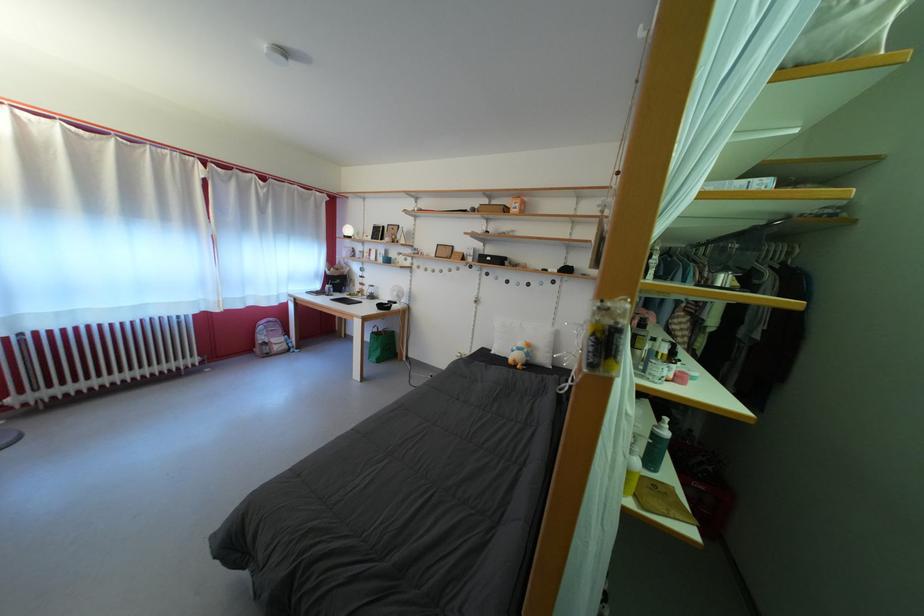
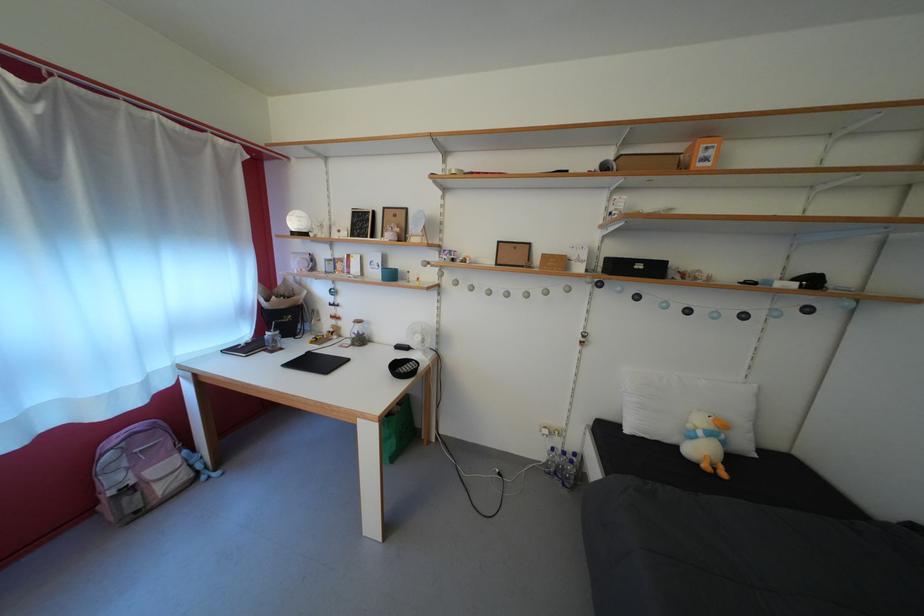
Where in the second image is the point corresponding to the point at 524,354 from the first image?

(709, 439)